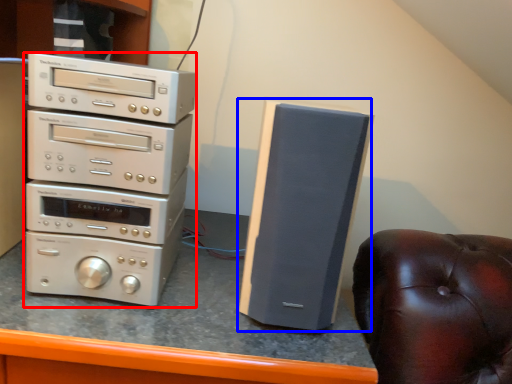
Question: Which object is further to the camera taking this photo, home appliance (highlighted by a red box) or speaker (highlighted by a blue box)?

Choices:
 (A) home appliance
 (B) speaker

Answer: (A)